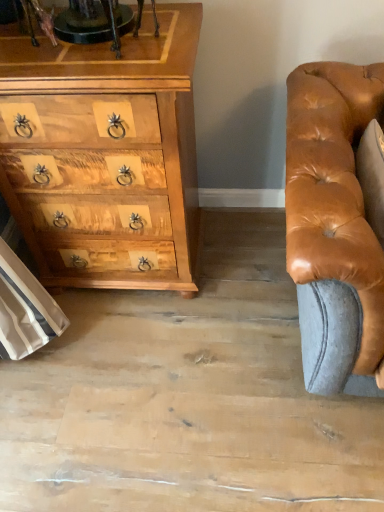
The image size is (384, 512). I want to click on vacant area that is in front of natural wood chest of drawers at left, so click(135, 366).